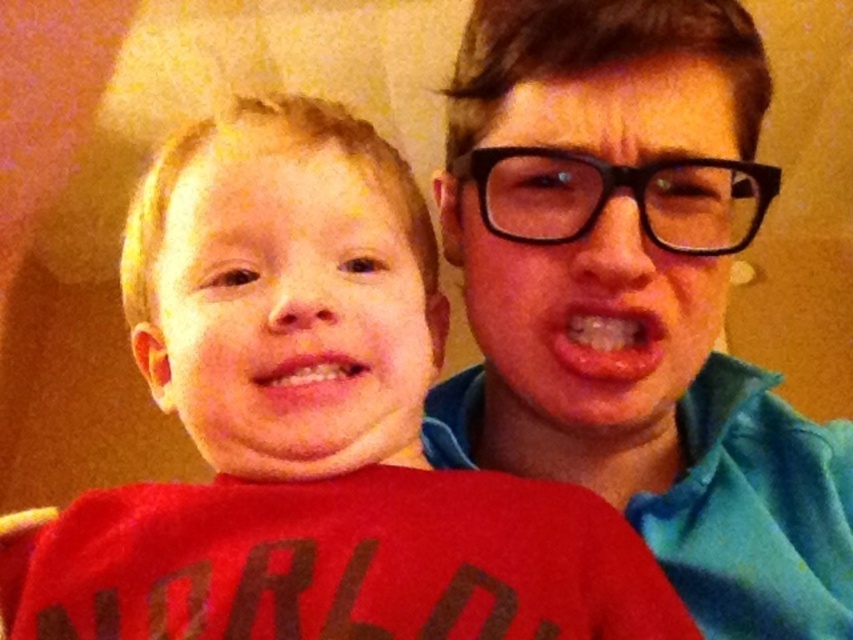
You are a photographer trying to capture a candid shot of the two children. The red matte shirt at left is worn by the child on the left. How far apart are the two children in the image?

The two children are 14.23 inches apart.

You are a photographer trying to capture a candid shot of the two children in the scene. You notice a specific point at coordinates (310, 429). Based on the scene description, where is this point located in relation to the red matte shirt at left?

The point at coordinates (310, 429) is located on the red matte shirt at left.

Consider the image. You are a photographer trying to capture a closeup shot of both the black plastic glasses at upper right and the pink glossy lips at center. The camera you are using has a lens that can focus on objects within a 6 inch range. Will you be able to capture both subjects in focus at the same time?

The black plastic glasses at upper right and pink glossy lips at center are 6.50 inches apart. Since the camera lens can only focus within a 6 inch range, the distance between them exceeds the lens capability. Therefore, you cannot capture both subjects in focus simultaneously.